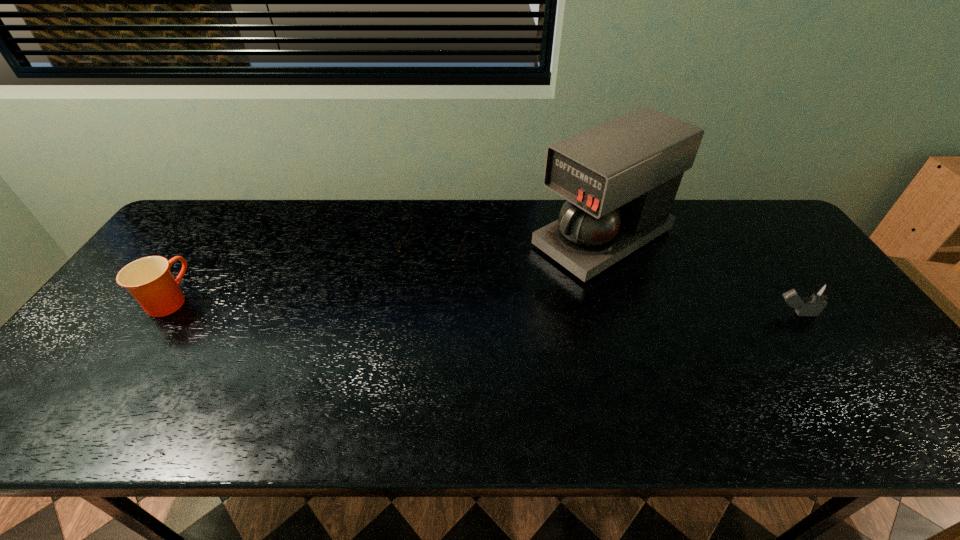
Identify the location of free space between the tallest object and the cup. (386, 269).

Find the location of `blank region between the spectacles and the rightmost object`. blank region between the spectacles and the rightmost object is located at coordinates (614, 283).

This screenshot has height=540, width=960. What are the coordinates of `empty space that is in between the spectacles and the coffee maker` in the screenshot? It's located at (519, 245).

Select which object is the third closest to the spectacles. Please provide its 2D coordinates. Your answer should be formatted as a tuple, i.e. [(x, y)], where the tuple contains the x and y coordinates of a point satisfying the conditions above.

[(815, 302)]

Where is `object that is the nearest to the rightmost object`? The height and width of the screenshot is (540, 960). object that is the nearest to the rightmost object is located at coordinates (620, 178).

I want to click on vacant point that satisfies the following two spatial constraints: 1. on the back side of the leftmost object; 2. on the right side of the second object from right to left, so click(x=212, y=238).

What are the coordinates of `free space that satisfies the following two spatial constraints: 1. on the front side of the rightmost object; 2. on the right side of the shortest object` in the screenshot? It's located at (428, 314).

Where is `vacant space that satisfies the following two spatial constraints: 1. on the back side of the coffee maker; 2. on the right side of the cup`? vacant space that satisfies the following two spatial constraints: 1. on the back side of the coffee maker; 2. on the right side of the cup is located at coordinates (212, 238).